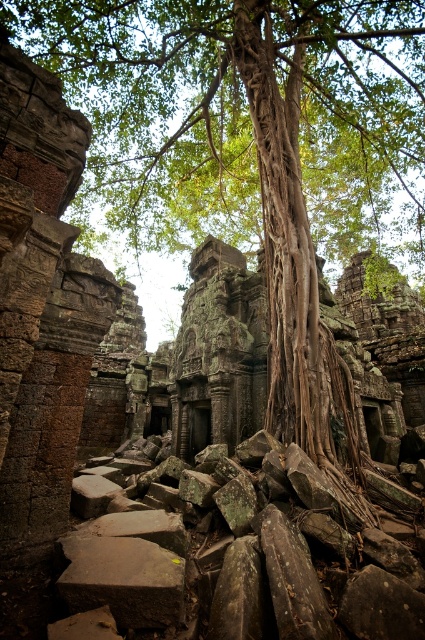
Question: Is brown rough tree trunk at center thinner than brown rough stone at lower center?

Choices:
 (A) no
 (B) yes

Answer: (A)

Question: Does brown rough tree trunk at center lie behind brown rough stone at lower center?

Choices:
 (A) no
 (B) yes

Answer: (B)

Question: Where is brown rough tree trunk at center located in relation to brown rough stone at lower center in the image?

Choices:
 (A) left
 (B) right

Answer: (B)